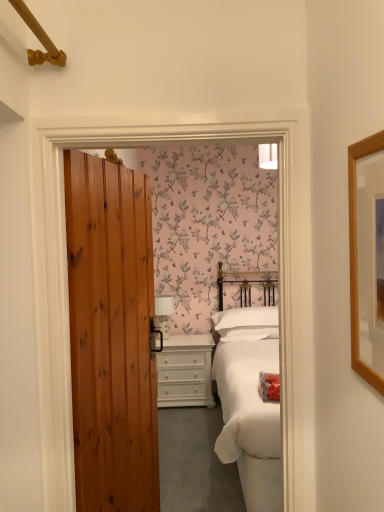
The image size is (384, 512). What do you see at coordinates (367, 258) in the screenshot?
I see `wooden picture frame at right` at bounding box center [367, 258].

Locate an element on the screen. This screenshot has height=512, width=384. wooden picture frame at right is located at coordinates (367, 258).

The height and width of the screenshot is (512, 384). Find the location of `wooden picture frame at right`. wooden picture frame at right is located at coordinates (367, 258).